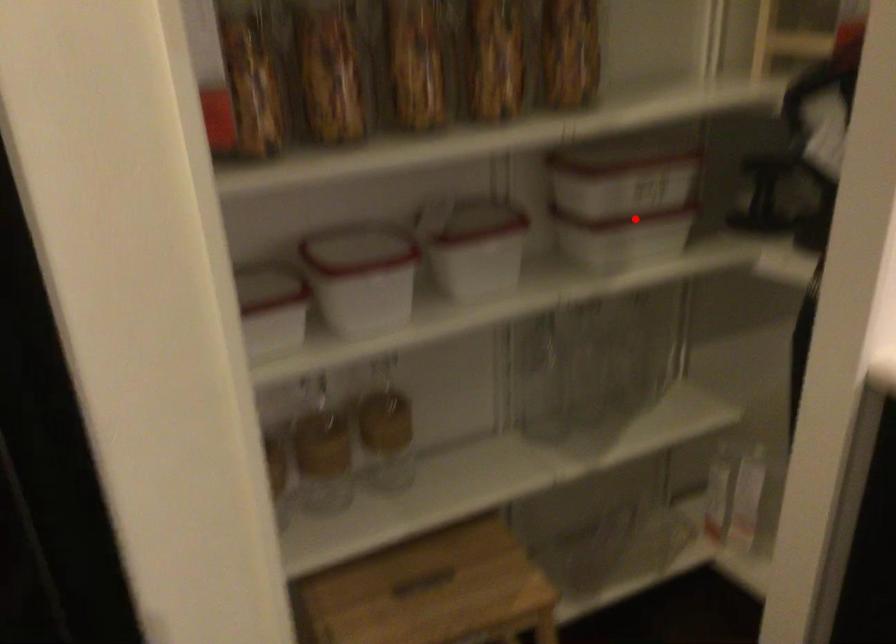
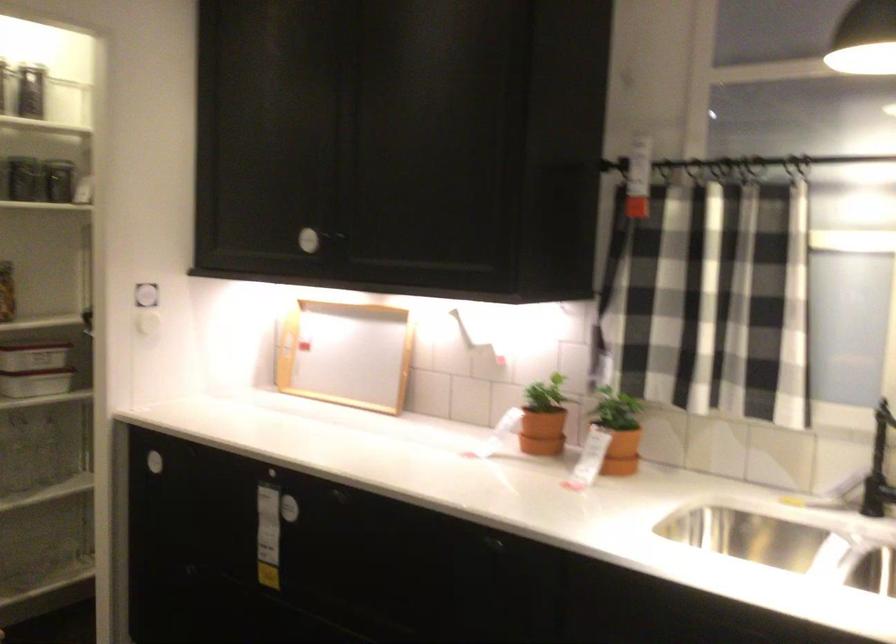
Find the pixel in the second image that matches the highlighted location in the first image.

(35, 368)